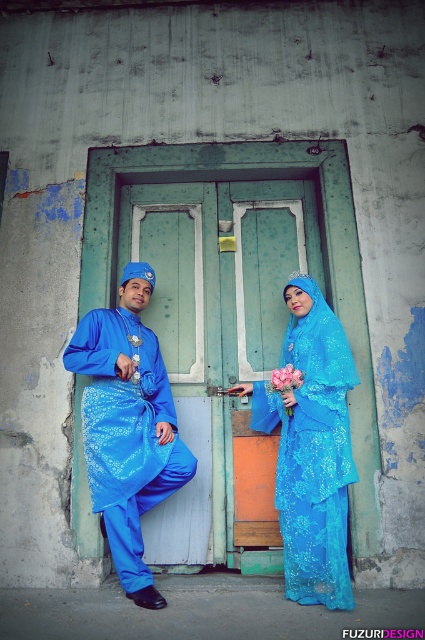
You are standing in front of the two people in traditional attire. The green wooden door at center is your destination. To reach it, you must walk through the space between the two individuals. Which direction should you move first to avoid bumping into either of them?

Since the green wooden door at center is located at point coordinates, you should move towards the center between the two individuals to reach the door without bumping into them.

You are a photographer trying to capture the shiny blue dress at center and the green wooden door at center in the same frame. Based on their positions, which object is located to the left of the other?

The green wooden door at center is positioned on the left side of shiny blue dress at center.